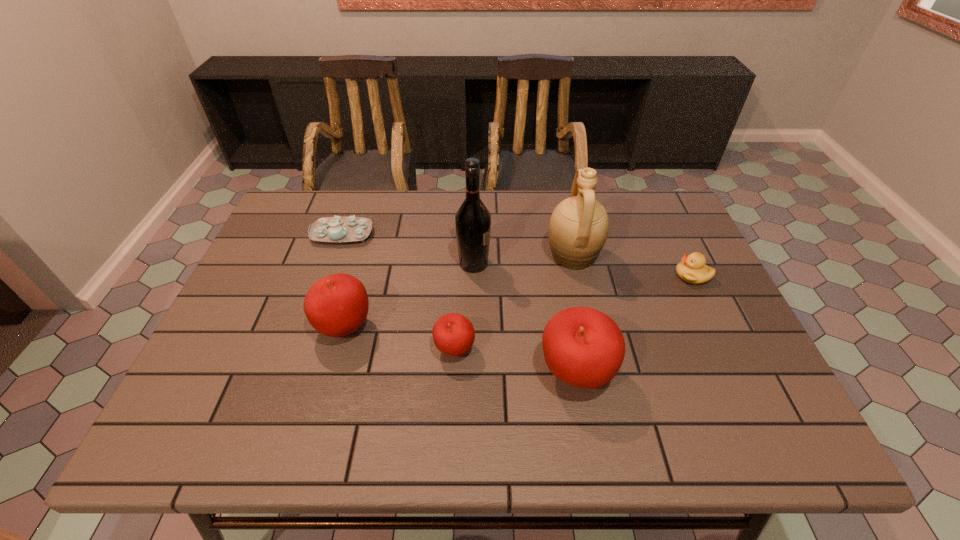
The height and width of the screenshot is (540, 960). Find the location of `vacant area between the rightmost apple and the chinaware`. vacant area between the rightmost apple and the chinaware is located at coordinates (459, 304).

Image resolution: width=960 pixels, height=540 pixels. In order to click on empty space between the second shortest apple and the second apple from left to right in this screenshot , I will do coord(399,339).

Where is `empty space that is in between the third shortest object and the wine bottle`? This screenshot has height=540, width=960. empty space that is in between the third shortest object and the wine bottle is located at coordinates coord(464,307).

This screenshot has height=540, width=960. In order to click on free space between the third shortest object and the wine bottle in this screenshot , I will do `click(464, 307)`.

At what (x,y) coordinates should I click in order to perform the action: click on vacant area between the fourth shortest object and the duckling. Please return your answer as a coordinate pair (x, y). Looking at the image, I should click on (518, 301).

The image size is (960, 540). Find the location of `vacant area between the chinaware and the third shortest object`. vacant area between the chinaware and the third shortest object is located at coordinates (398, 292).

Identify the location of object that stands as the fifth closest to the shortest apple. Image resolution: width=960 pixels, height=540 pixels. (331, 229).

Identify which object is the fourth nearest to the pitcher. Please provide its 2D coordinates. Your answer should be formatted as a tuple, i.e. [(x, y)], where the tuple contains the x and y coordinates of a point satisfying the conditions above.

[(453, 334)]

Where is `apple identified as the second closest to the duckling`? This screenshot has width=960, height=540. apple identified as the second closest to the duckling is located at coordinates (453, 334).

Identify which apple is located as the nearest to the duckling. Please provide its 2D coordinates. Your answer should be formatted as a tuple, i.e. [(x, y)], where the tuple contains the x and y coordinates of a point satisfying the conditions above.

[(583, 347)]